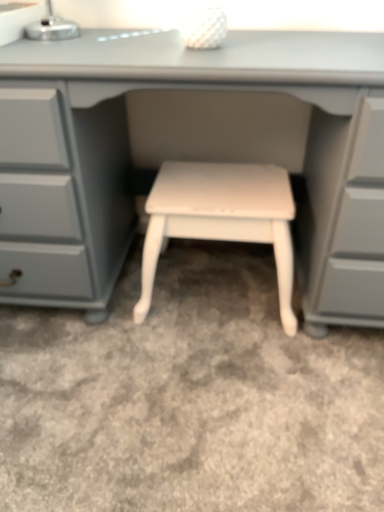
Question: Is point (336, 189) closer or farther from the camera than point (279, 193)?

Choices:
 (A) closer
 (B) farther

Answer: (A)

Question: Based on their sizes in the image, would you say matte gray desk at center is bigger or smaller than white painted wood stool at center?

Choices:
 (A) big
 (B) small

Answer: (A)

Question: In terms of width, does matte gray desk at center look wider or thinner when compared to white painted wood stool at center?

Choices:
 (A) wide
 (B) thin

Answer: (A)

Question: Considering the relative positions of white painted wood stool at center and matte gray desk at center in the image provided, is white painted wood stool at center to the left or to the right of matte gray desk at center?

Choices:
 (A) left
 (B) right

Answer: (B)

Question: Choose the correct answer: Is white painted wood stool at center inside matte gray desk at center or outside it?

Choices:
 (A) outside
 (B) inside

Answer: (B)

Question: Relative to matte gray desk at center, is white painted wood stool at center in front or behind?

Choices:
 (A) behind
 (B) front

Answer: (A)

Question: From a real-world perspective, relative to matte gray desk at center, is white painted wood stool at center vertically above or below?

Choices:
 (A) above
 (B) below

Answer: (B)